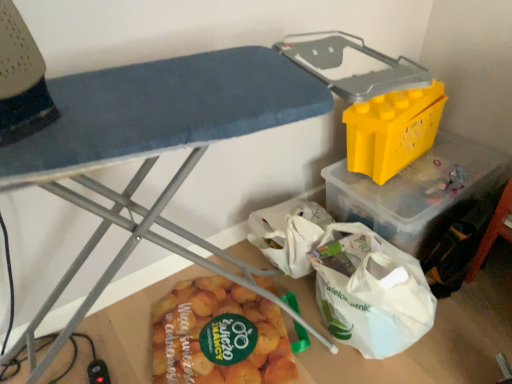
Question: Is yellow plastic container at upper right in contact with yellow plastic storage bin at upper right?

Choices:
 (A) yes
 (B) no

Answer: (B)

Question: From a real-world perspective, is yellow plastic container at upper right beneath yellow plastic storage bin at upper right?

Choices:
 (A) yes
 (B) no

Answer: (A)

Question: Is yellow plastic container at upper right looking in the opposite direction of yellow plastic storage bin at upper right?

Choices:
 (A) no
 (B) yes

Answer: (A)

Question: Could you tell me if yellow plastic container at upper right is facing yellow plastic storage bin at upper right?

Choices:
 (A) no
 (B) yes

Answer: (A)

Question: Can we say yellow plastic container at upper right lies outside yellow plastic storage bin at upper right?

Choices:
 (A) yes
 (B) no

Answer: (A)

Question: Is yellow plastic container at upper right smaller than yellow plastic storage bin at upper right?

Choices:
 (A) yes
 (B) no

Answer: (A)

Question: Considering the relative positions of yellow matte potato at lower center and yellow plastic storage bin at upper right in the image provided, is yellow matte potato at lower center to the right of yellow plastic storage bin at upper right from the viewer's perspective?

Choices:
 (A) yes
 (B) no

Answer: (A)

Question: Is yellow matte potato at lower center thinner than yellow plastic storage bin at upper right?

Choices:
 (A) no
 (B) yes

Answer: (B)

Question: From a real-world perspective, is yellow matte potato at lower center located higher than yellow plastic storage bin at upper right?

Choices:
 (A) no
 (B) yes

Answer: (A)

Question: Is yellow matte potato at lower center positioned far away from yellow plastic storage bin at upper right?

Choices:
 (A) no
 (B) yes

Answer: (A)

Question: Could you tell me if yellow matte potato at lower center is facing yellow plastic storage bin at upper right?

Choices:
 (A) yes
 (B) no

Answer: (A)

Question: Can we say yellow matte potato at lower center lies outside yellow plastic storage bin at upper right?

Choices:
 (A) yes
 (B) no

Answer: (B)

Question: Does yellow plastic storage bin at upper right have a lesser width compared to yellow plastic container at upper right?

Choices:
 (A) yes
 (B) no

Answer: (B)